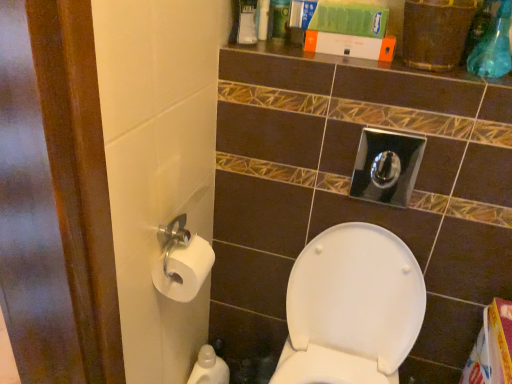
Question: Does white glossy plastic bottle at lower left have a larger size compared to white plastic container at upper center, which ranks as the first toiletry in right-to-left order?

Choices:
 (A) yes
 (B) no

Answer: (A)

Question: Considering the relative positions of white glossy plastic bottle at lower left and white plastic container at upper center, which appears as the 1th toiletry when viewed from the top, in the image provided, is white glossy plastic bottle at lower left in front of white plastic container at upper center, which appears as the 1th toiletry when viewed from the top,?

Choices:
 (A) yes
 (B) no

Answer: (B)

Question: Is white glossy plastic bottle at lower left far away from white plastic container at upper center, which appears as the 1th toiletry when viewed from the top?

Choices:
 (A) no
 (B) yes

Answer: (B)

Question: Are white glossy plastic bottle at lower left and white plastic container at upper center, the 1th toiletry positioned from the back, making contact?

Choices:
 (A) yes
 (B) no

Answer: (B)

Question: From a real-world perspective, is white glossy plastic bottle at lower left located higher than white plastic container at upper center, the second toiletry positioned from the bottom?

Choices:
 (A) yes
 (B) no

Answer: (B)

Question: Is point pos(257,18) positioned closer to the camera than point pos(206,253)?

Choices:
 (A) closer
 (B) farther

Answer: (B)

Question: Is white plastic container at upper center, the second toiletry positioned from the bottom, to the left or to the right of white paper at left, the first toiletry positioned from the left, in the image?

Choices:
 (A) right
 (B) left

Answer: (A)

Question: From the image's perspective, relative to white paper at left, which is the first toiletry in bottom-to-top order, is white plastic container at upper center, acting as the 2th toiletry starting from the left, above or below?

Choices:
 (A) below
 (B) above

Answer: (B)

Question: Is white plastic container at upper center, the second toiletry positioned from the bottom, wider or thinner than white paper at left, which is the second toiletry in back-to-front order?

Choices:
 (A) wide
 (B) thin

Answer: (B)

Question: Is white paper at left, the 2th toiletry positioned from the top, taller or shorter than white glossy plastic bottle at lower left?

Choices:
 (A) tall
 (B) short

Answer: (B)

Question: Which is correct: white paper at left, positioned as the second toiletry in right-to-left order, is inside white glossy plastic bottle at lower left, or outside of it?

Choices:
 (A) inside
 (B) outside

Answer: (B)

Question: Considering their positions, is white paper at left, the 2th toiletry positioned from the top, located in front of or behind white glossy plastic bottle at lower left?

Choices:
 (A) behind
 (B) front

Answer: (B)

Question: From a real-world perspective, is white paper at left, positioned as the second toiletry in right-to-left order, positioned above or below white glossy plastic bottle at lower left?

Choices:
 (A) below
 (B) above

Answer: (B)

Question: In terms of height, does white paper at left, the 2th toiletry positioned from the top, look taller or shorter compared to white glossy toilet seat at center?

Choices:
 (A) tall
 (B) short

Answer: (B)

Question: Considering the relative positions of white paper at left, the first toiletry positioned from the left, and white glossy toilet seat at center in the image provided, is white paper at left, the first toiletry positioned from the left, to the left or to the right of white glossy toilet seat at center?

Choices:
 (A) left
 (B) right

Answer: (A)